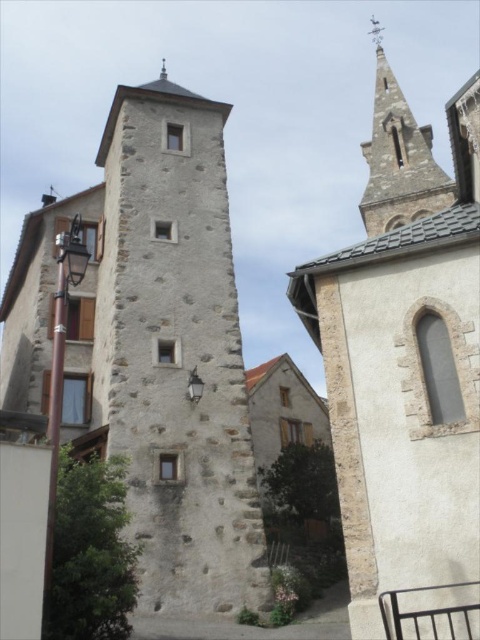
Between stone tower at center and smooth stone steeple at upper right, which one appears on the right side from the viewer's perspective?

smooth stone steeple at upper right is more to the right.

Between point (118, 348) and point (373, 228), which one is positioned in front?

Positioned in front is point (118, 348).

This screenshot has height=640, width=480. What are the coordinates of `stone tower at center` in the screenshot? It's located at [x=176, y=353].

Where is `stone steeple at upper right`? stone steeple at upper right is located at coordinates (405, 355).

Between point (454, 436) and point (427, 186), which one is positioned behind?

Point (427, 186)

Is point (333, 349) positioned before point (396, 116)?

Yes, point (333, 349) is in front of point (396, 116).

At what (x,y) coordinates should I click in order to perform the action: click on stone steeple at upper right. Please return your answer as a coordinate pair (x, y). Looking at the image, I should click on (405, 355).

Does point (389, 568) come in front of point (119, 390)?

Yes, point (389, 568) is in front of point (119, 390).

The width and height of the screenshot is (480, 640). What do you see at coordinates (405, 355) in the screenshot?
I see `stone steeple at upper right` at bounding box center [405, 355].

You are a GUI agent. You are given a task and a screenshot of the screen. Output one action in this format:
    pyautogui.click(x=<x>, y=<y>)
    Task: Click on the stone steeple at upper right
    
    Given the screenshot: What is the action you would take?
    pyautogui.click(x=405, y=355)